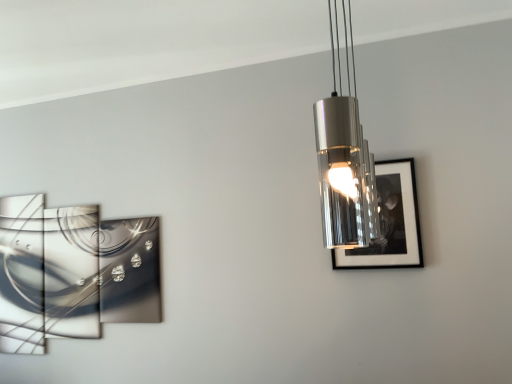
Locate an element on the screen. This screenshot has height=384, width=512. metallic reflective artwork at left, placed as the 1th picture frame when sorted from back to front is located at coordinates (130, 271).

This screenshot has height=384, width=512. I want to click on black glossy picture frame at right, positioned as the first picture frame in right-to-left order, so click(390, 222).

From the picture: Considering the relative sizes of metallic reflective artwork at left, the second picture frame positioned from the right, and black glossy picture frame at right, acting as the 1th picture frame starting from the front, in the image provided, is metallic reflective artwork at left, the second picture frame positioned from the right, wider than black glossy picture frame at right, acting as the 1th picture frame starting from the front,?

Yes.

Is point (111, 296) positioned before point (402, 190)?

No, it is not.

Is metallic reflective artwork at left, the second picture frame when ordered from front to back, behind black glossy picture frame at right, positioned as the first picture frame in right-to-left order?

Yes, it is behind black glossy picture frame at right, positioned as the first picture frame in right-to-left order.

Is metallic reflective artwork at left, the second picture frame positioned from the right, facing away from black glossy picture frame at right, positioned as the second picture frame in back-to-front order?

metallic reflective artwork at left, the second picture frame positioned from the right, does not have its back to black glossy picture frame at right, positioned as the second picture frame in back-to-front order.

Between black glossy picture frame at right, acting as the 1th picture frame starting from the front, and metallic reflective artwork at left, the second picture frame when ordered from front to back, which one is positioned behind?

metallic reflective artwork at left, the second picture frame when ordered from front to back, is further from the camera.

Between black glossy picture frame at right, positioned as the second picture frame in back-to-front order, and metallic reflective artwork at left, which is the first picture frame from left to right, which one has less height?

Standing shorter between the two is black glossy picture frame at right, positioned as the second picture frame in back-to-front order.

Identify the location of picture frame located below the black glossy picture frame at right, acting as the 1th picture frame starting from the front (from the image's perspective). (130, 271).

From a real-world perspective, between black glossy picture frame at right, positioned as the second picture frame in back-to-front order, and metallic reflective artwork at left, the second picture frame when ordered from front to back, who is vertically higher?

black glossy picture frame at right, positioned as the second picture frame in back-to-front order, is physically above.

Is metallic reflective artwork at left, the second picture frame positioned from the right, positioned beyond the bounds of metallic cylindrical light fixture at upper center?

Yes, metallic reflective artwork at left, the second picture frame positioned from the right, is outside of metallic cylindrical light fixture at upper center.

Is metallic reflective artwork at left, which is the first picture frame from left to right, looking in the opposite direction of metallic cylindrical light fixture at upper center?

No.

From a real-world perspective, is metallic reflective artwork at left, the second picture frame positioned from the right, located beneath metallic cylindrical light fixture at upper center?

Yes, from a real-world perspective, metallic reflective artwork at left, the second picture frame positioned from the right, is under metallic cylindrical light fixture at upper center.

Identify the location of lamp that is on the right side of metallic reflective artwork at left, the second picture frame positioned from the right. (344, 159).

From the image's perspective, is metallic cylindrical light fixture at upper center below metallic reflective artwork at left, the second picture frame when ordered from front to back?

No, from the image's perspective, metallic cylindrical light fixture at upper center is not below metallic reflective artwork at left, the second picture frame when ordered from front to back.

Is point (332, 191) less distant than point (142, 277)?

Yes, point (332, 191) is in front of point (142, 277).

From a real-world perspective, relative to metallic reflective artwork at left, placed as the 1th picture frame when sorted from back to front, is metallic cylindrical light fixture at upper center vertically above or below?

In terms of real-world spatial position, metallic cylindrical light fixture at upper center is above metallic reflective artwork at left, placed as the 1th picture frame when sorted from back to front.

Who is bigger, metallic cylindrical light fixture at upper center or metallic reflective artwork at left, which is the first picture frame from left to right?

With larger size is metallic cylindrical light fixture at upper center.

Is black glossy picture frame at right, positioned as the second picture frame in back-to-front order, aimed at metallic cylindrical light fixture at upper center?

Yes, black glossy picture frame at right, positioned as the second picture frame in back-to-front order, is oriented towards metallic cylindrical light fixture at upper center.

From the image's perspective, starting from the metallic cylindrical light fixture at upper center, which picture frame is the 1st one below? Please provide its 2D coordinates.

[(390, 222)]

Between black glossy picture frame at right, marked as the second picture frame in a left-to-right arrangement, and metallic cylindrical light fixture at upper center, which one has larger width?

metallic cylindrical light fixture at upper center.

From the image's perspective, is black glossy picture frame at right, marked as the second picture frame in a left-to-right arrangement, above or below metallic cylindrical light fixture at upper center?

black glossy picture frame at right, marked as the second picture frame in a left-to-right arrangement, is situated lower than metallic cylindrical light fixture at upper center in the image.

Between metallic cylindrical light fixture at upper center and black glossy picture frame at right, marked as the second picture frame in a left-to-right arrangement, which one appears on the right side from the viewer's perspective?

black glossy picture frame at right, marked as the second picture frame in a left-to-right arrangement, is more to the right.

From the image's perspective, is metallic cylindrical light fixture at upper center located above or below black glossy picture frame at right, positioned as the second picture frame in back-to-front order?

Clearly, from the image's perspective, metallic cylindrical light fixture at upper center is above black glossy picture frame at right, positioned as the second picture frame in back-to-front order.

Is point (321, 187) positioned after point (373, 245)?

No, it is not.

At what (x,y) coordinates should I click in order to perform the action: click on picture frame above the metallic reflective artwork at left, placed as the 1th picture frame when sorted from back to front (from a real-world perspective). Please return your answer as a coordinate pair (x, y). Looking at the image, I should click on (390, 222).

Identify the location of picture frame that is below the black glossy picture frame at right, marked as the second picture frame in a left-to-right arrangement (from the image's perspective). The image size is (512, 384). (130, 271).

When comparing their distances from metallic reflective artwork at left, the second picture frame when ordered from front to back, does black glossy picture frame at right, positioned as the first picture frame in right-to-left order, or metallic cylindrical light fixture at upper center seem further?

metallic cylindrical light fixture at upper center is further to metallic reflective artwork at left, the second picture frame when ordered from front to back.

Estimate the real-world distances between objects in this image. Which object is closer to black glossy picture frame at right, acting as the 1th picture frame starting from the front, metallic cylindrical light fixture at upper center or metallic reflective artwork at left, the second picture frame when ordered from front to back?

metallic cylindrical light fixture at upper center.

Based on their spatial positions, is metallic reflective artwork at left, the second picture frame when ordered from front to back, or black glossy picture frame at right, positioned as the second picture frame in back-to-front order, closer to metallic cylindrical light fixture at upper center?

black glossy picture frame at right, positioned as the second picture frame in back-to-front order, lies closer to metallic cylindrical light fixture at upper center than the other object.

Estimate the real-world distances between objects in this image. Which object is further from metallic cylindrical light fixture at upper center, black glossy picture frame at right, positioned as the first picture frame in right-to-left order, or metallic reflective artwork at left, placed as the 1th picture frame when sorted from back to front?

metallic reflective artwork at left, placed as the 1th picture frame when sorted from back to front, is further to metallic cylindrical light fixture at upper center.

From the image, which object appears to be farther from black glossy picture frame at right, positioned as the first picture frame in right-to-left order, metallic reflective artwork at left, placed as the 1th picture frame when sorted from back to front, or metallic cylindrical light fixture at upper center?

metallic reflective artwork at left, placed as the 1th picture frame when sorted from back to front, is further to black glossy picture frame at right, positioned as the first picture frame in right-to-left order.

Based on the photo, based on their spatial positions, is metallic cylindrical light fixture at upper center or black glossy picture frame at right, positioned as the second picture frame in back-to-front order, closer to metallic reflective artwork at left, placed as the 1th picture frame when sorted from back to front?

black glossy picture frame at right, positioned as the second picture frame in back-to-front order, lies closer to metallic reflective artwork at left, placed as the 1th picture frame when sorted from back to front, than the other object.

I want to click on picture frame between metallic cylindrical light fixture at upper center and metallic reflective artwork at left, the second picture frame when ordered from front to back, along the z-axis, so click(390, 222).